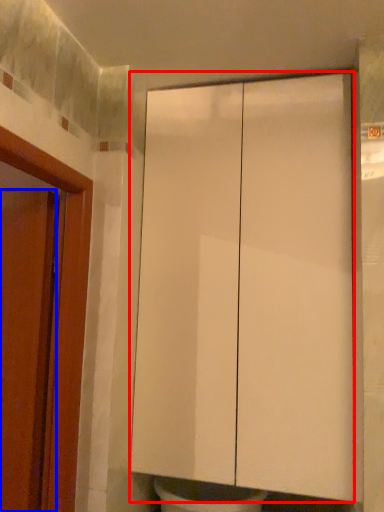
Question: Which object appears closest to the camera in this image, cabinetry (highlighted by a red box) or door (highlighted by a blue box)?

Choices:
 (A) cabinetry
 (B) door

Answer: (B)